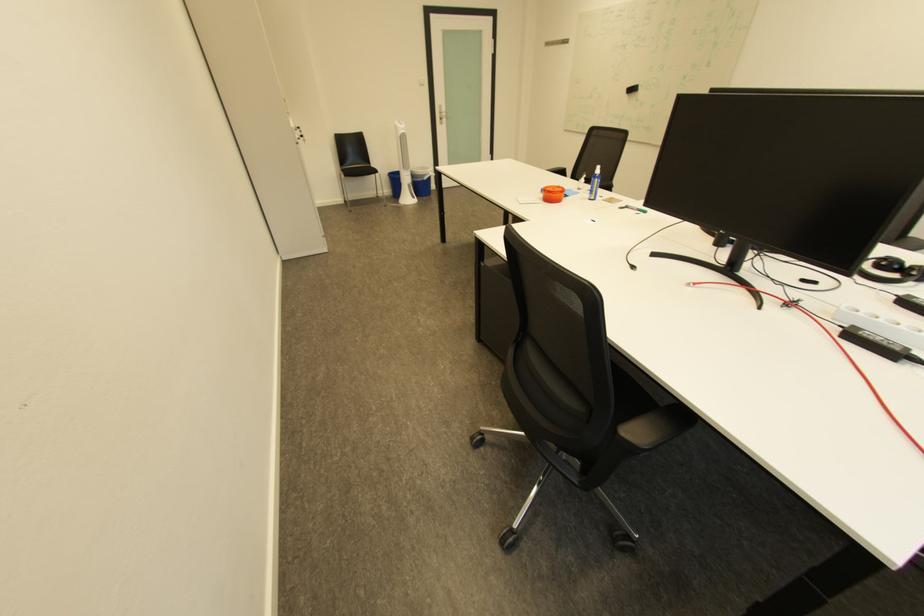
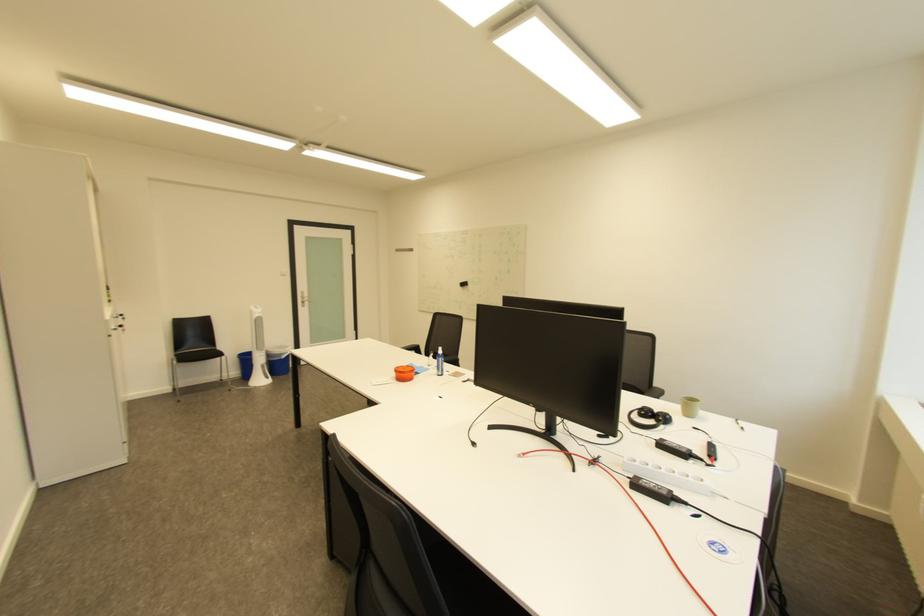
Find the pixel in the second image that matches point 551,196 in the first image.

(404, 376)